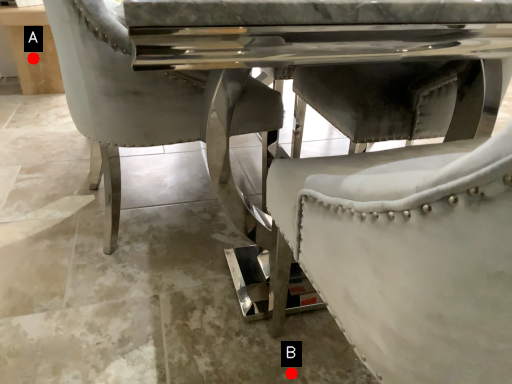
Question: Two points are circled on the image, labeled by A and B beside each circle. Which point appears farthest from the camera in this image?

Choices:
 (A) A is further
 (B) B is further

Answer: (A)